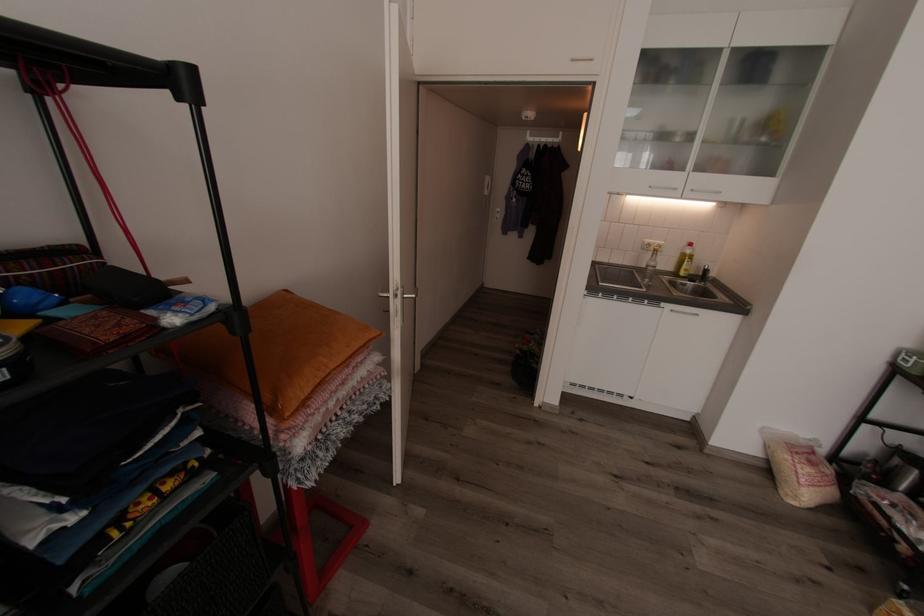
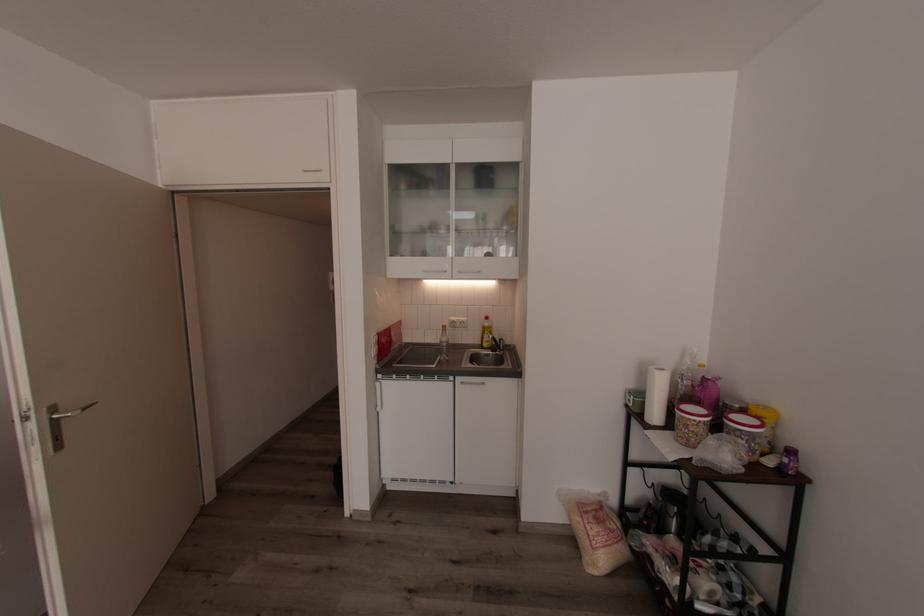
In the second image, find the point that corresponds to pixel 723 192 in the first image.

(484, 272)